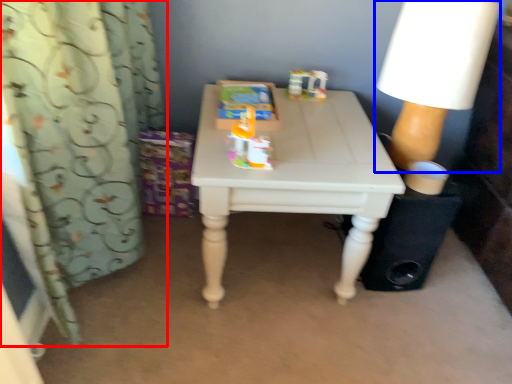
Question: Among these objects, which one is nearest to the camera, curtain (highlighted by a red box) or lamp (highlighted by a blue box)?

Choices:
 (A) curtain
 (B) lamp

Answer: (A)